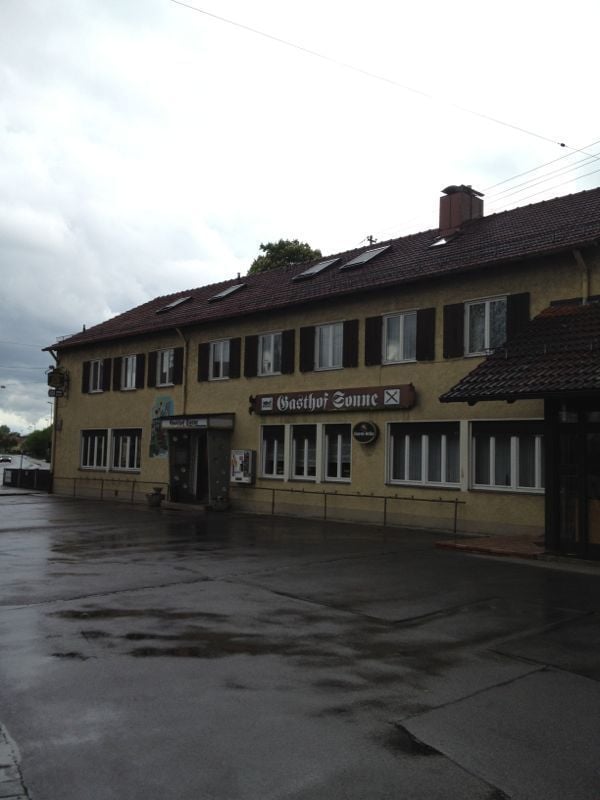
Locate an element on the screen. The image size is (600, 800). yellow wall is located at coordinates (87, 413).